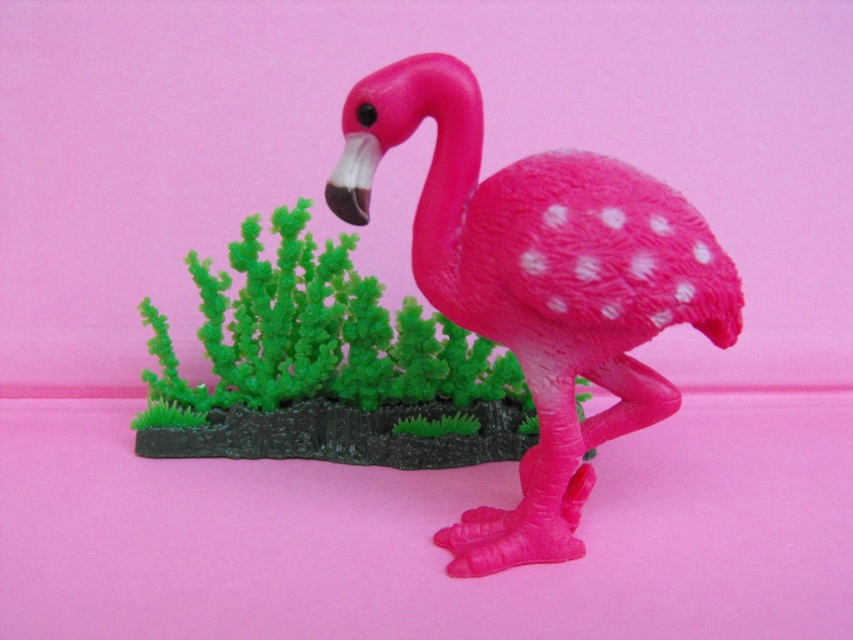
Question: Is matte plastic flamingo at center thinner than green matte plant at center?

Choices:
 (A) no
 (B) yes

Answer: (B)

Question: Which object is closer to the camera taking this photo?

Choices:
 (A) matte plastic flamingo at center
 (B) green matte plant at center

Answer: (A)

Question: Which object appears closest to the camera in this image?

Choices:
 (A) green matte plant at center
 (B) matte plastic flamingo at center

Answer: (B)

Question: Is matte plastic flamingo at center in front of green matte plant at center?

Choices:
 (A) no
 (B) yes

Answer: (B)

Question: Is matte plastic flamingo at center positioned at the back of green matte plant at center?

Choices:
 (A) yes
 (B) no

Answer: (B)